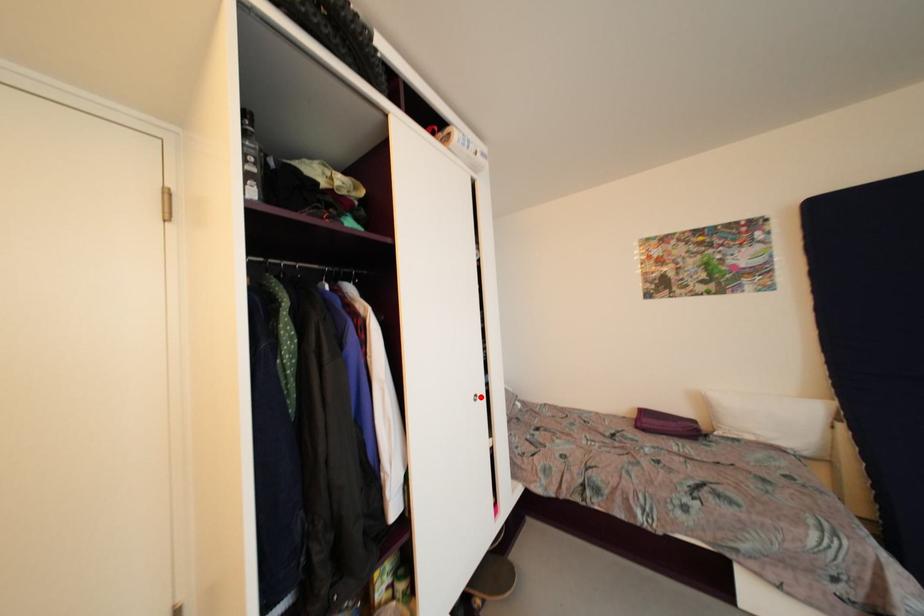
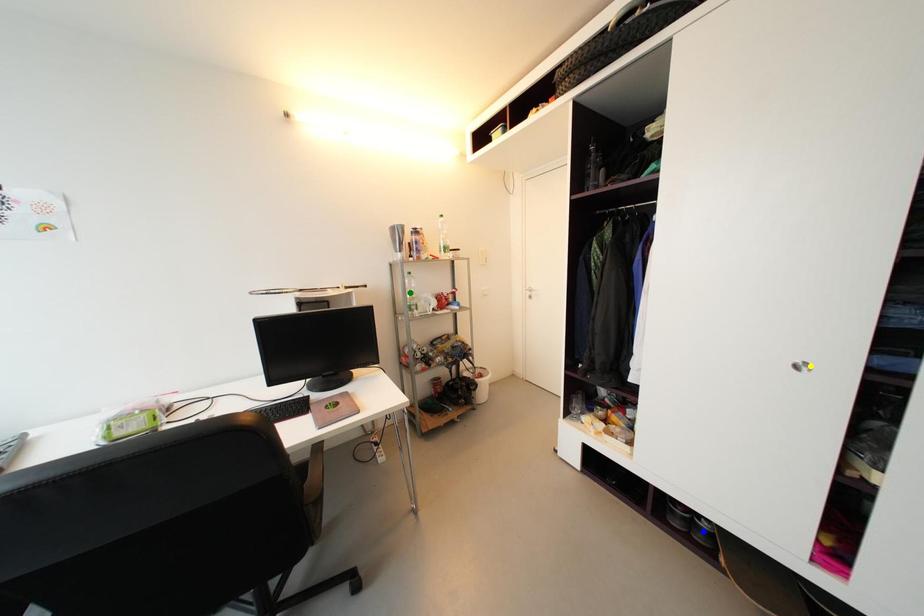
Question: I am providing you with two images of the same scene from different viewpoints. A red point is marked on the first image. You are given multiple points on the second image. Can you choose the point in image 2 that corresponds to the point in image 1?

Choices:
 (A) green point
 (B) yellow point
 (C) blue point

Answer: (B)